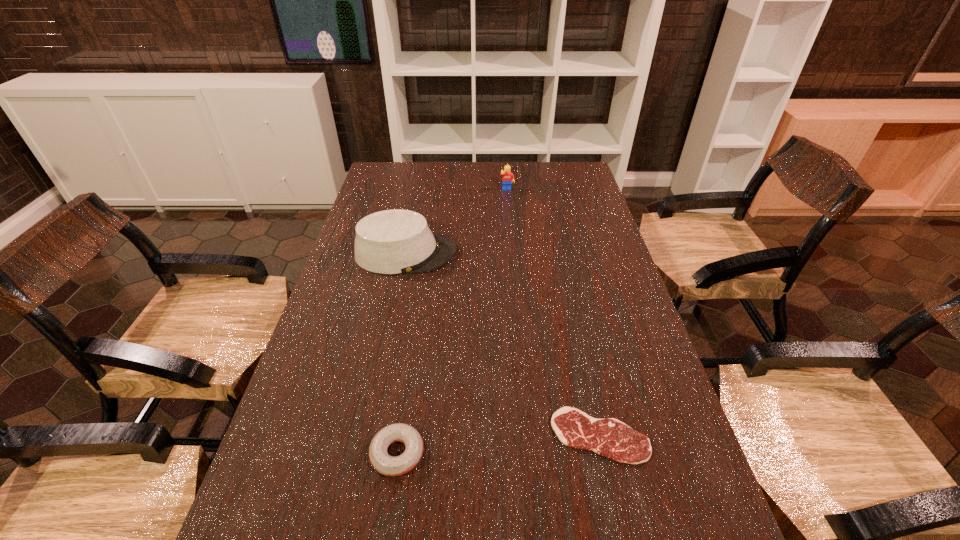
What are the coordinates of `free space that satisfies the following two spatial constraints: 1. on the face of the farthest object; 2. on the front-facing side of the third nearest object` in the screenshot? It's located at (513, 253).

At what (x,y) coordinates should I click in order to perform the action: click on free space that satisfies the following two spatial constraints: 1. on the face of the Lego; 2. on the front-facing side of the hat. Please return your answer as a coordinate pair (x, y). Looking at the image, I should click on (513, 253).

Image resolution: width=960 pixels, height=540 pixels. What are the coordinates of `free space that satisfies the following two spatial constraints: 1. on the front-facing side of the hat; 2. on the left side of the third tallest object` in the screenshot? It's located at (365, 454).

This screenshot has height=540, width=960. What are the coordinates of `vacant region that satisfies the following two spatial constraints: 1. on the front-facing side of the hat; 2. on the right side of the second shortest object` in the screenshot? It's located at (365, 454).

In order to click on vacant space that satisfies the following two spatial constraints: 1. on the front-facing side of the hat; 2. on the left side of the rightmost object in this screenshot , I will do `click(369, 436)`.

Find the location of `vacant space that satisfies the following two spatial constraints: 1. on the face of the third object from left to right; 2. on the front-facing side of the third nearest object`. vacant space that satisfies the following two spatial constraints: 1. on the face of the third object from left to right; 2. on the front-facing side of the third nearest object is located at coordinates point(513,253).

At what (x,y) coordinates should I click in order to perform the action: click on blank space that satisfies the following two spatial constraints: 1. on the front-facing side of the second farthest object; 2. on the left side of the steak. Please return your answer as a coordinate pair (x, y). The width and height of the screenshot is (960, 540). Looking at the image, I should click on (369, 436).